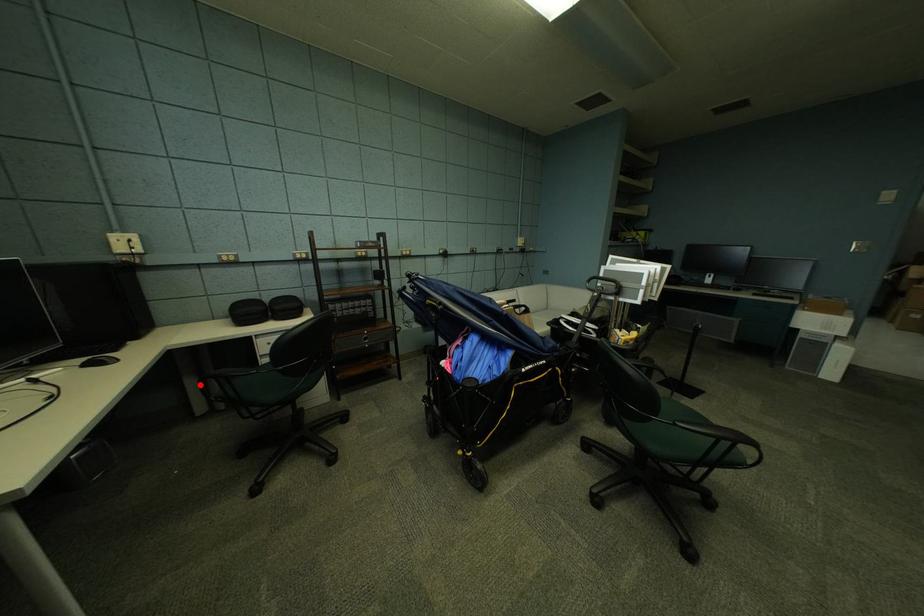
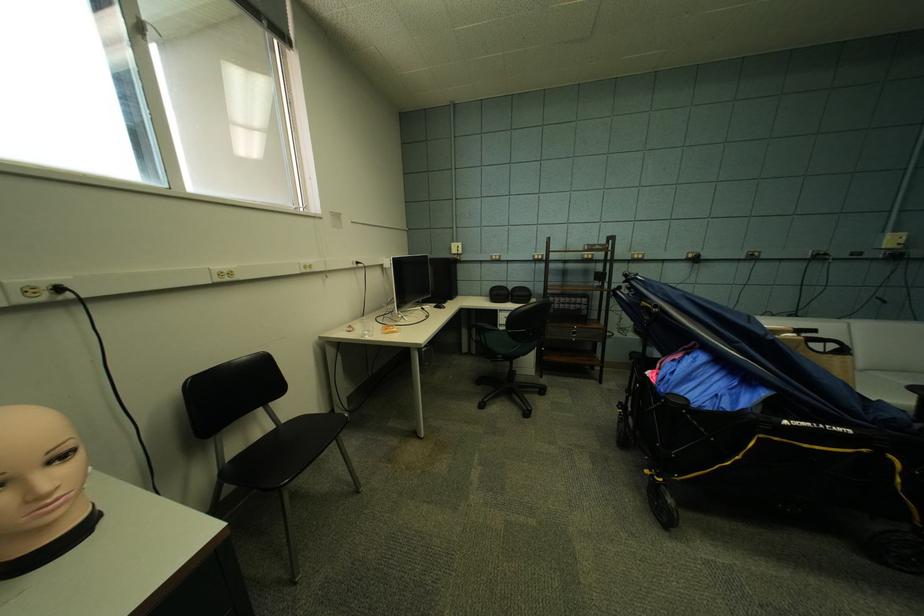
Find the pixel in the second image that matches the highlighted location in the first image.

(473, 333)